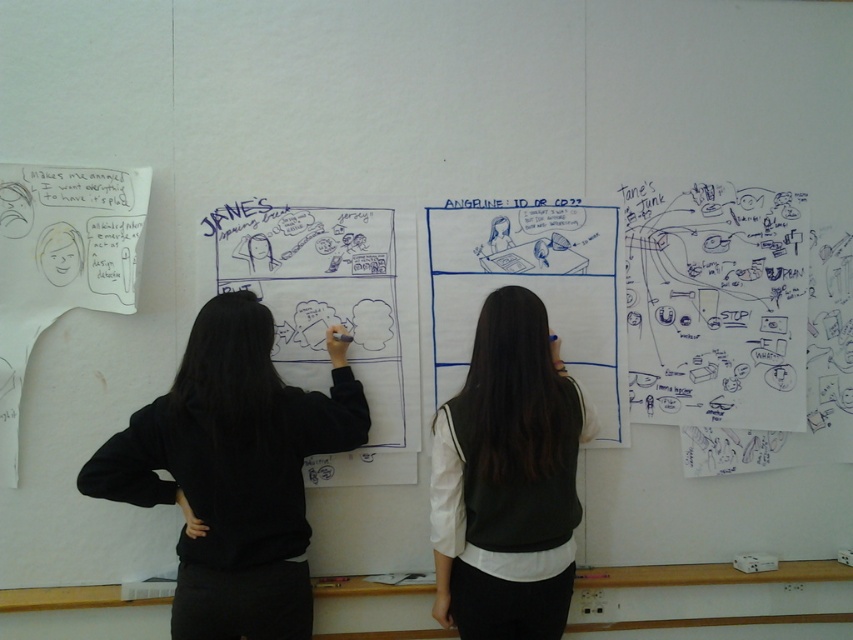
You are an observer standing in front of the whiteboard. You notice two items on the whiteboard. The first is the black matte jacket at left and the second is the white matte vest at center. Which item is covering part of the other?

The black matte jacket at left is positioned over white matte vest at center, so it is covering part of the white matte vest at center.

You are a delivery person standing at the viewer position, and you need to deliver a package to the black matte jacket at left. The delivery robot you are using has a maximum reach of 2 meters. Can the robot deliver the package to the jacket without moving closer?

The black matte jacket at left and the viewer are 1.96 meters apart from each other, so yes, the robot can deliver the package to the jacket without moving closer since the distance is within its 2 meters reach.